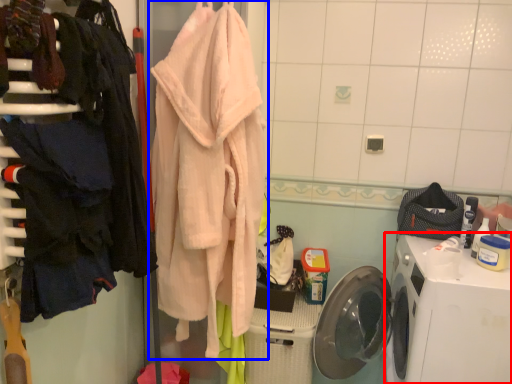
Question: Which of the following is the closest to the observer, washing machine (highlighted by a red box) or towel (highlighted by a blue box)?

Choices:
 (A) washing machine
 (B) towel

Answer: (B)